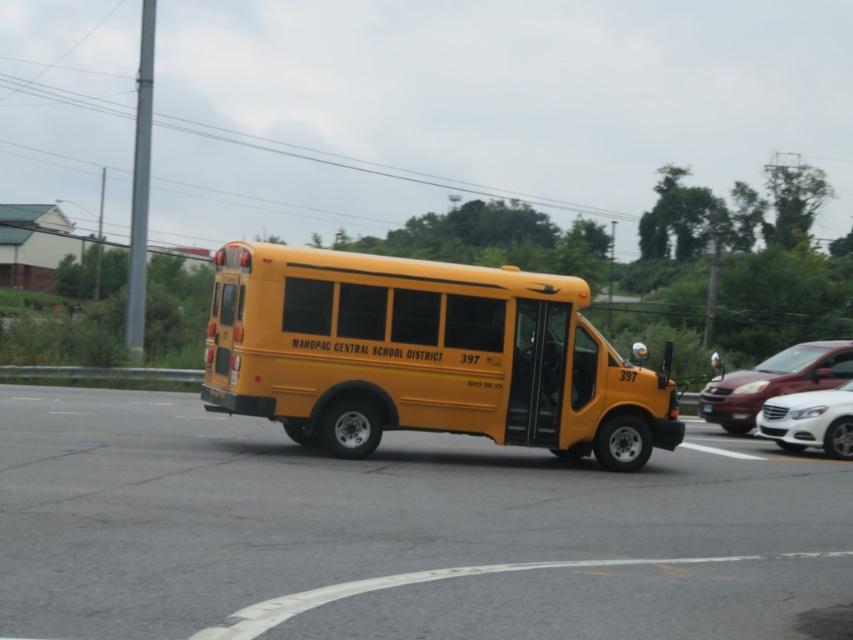
Question: Can you confirm if matte white sedan at right is bigger than white glossy sedan at center?

Choices:
 (A) no
 (B) yes

Answer: (B)

Question: Which of the following is the closest to the observer?

Choices:
 (A) (813, 428)
 (B) (328, 269)

Answer: (B)

Question: Among these objects, which one is nearest to the camera?

Choices:
 (A) white glossy sedan at center
 (B) matte white sedan at right
 (C) yellow matte school bus at center

Answer: (C)

Question: Observing the image, what is the correct spatial positioning of yellow matte school bus at center in reference to matte white sedan at right?

Choices:
 (A) right
 (B) left

Answer: (B)

Question: In this image, where is matte white sedan at right located relative to white glossy sedan at center?

Choices:
 (A) left
 (B) right

Answer: (B)

Question: Among these objects, which one is nearest to the camera?

Choices:
 (A) yellow matte school bus at center
 (B) matte white sedan at right
 (C) white glossy sedan at center

Answer: (A)